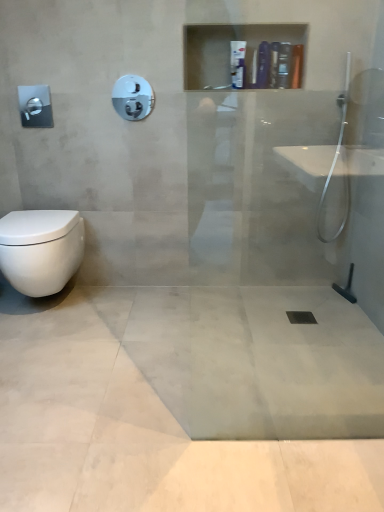
Question: Is point click(x=173, y=422) positioned closer to the camera than point click(x=281, y=49)?

Choices:
 (A) closer
 (B) farther

Answer: (A)

Question: Considering their positions, is light gray concrete at center located in front of or behind matte black soap dispenser at upper center, which ranks as the second toiletry in right-to-left order?

Choices:
 (A) behind
 (B) front

Answer: (B)

Question: Which object is the farthest from the white glossy towel bar at upper center, positioned as the first towel bar in top-to-bottom order?

Choices:
 (A) matte black soap dispenser at upper center, which ranks as the second toiletry in right-to-left order
 (B) silver metallic towel bar at upper left, the 1th towel bar when ordered from left to right
 (C) white glossy bottle at upper center, the 4th toiletry in the right-to-left sequence
 (D) white glossy bottle at upper center, which appears as the 1th toiletry when viewed from the left
 (E) matte plastic bottle at upper center, the third toiletry when ordered from left to right

Answer: (B)

Question: Considering the real-world distances, which object is closest to the white glossy toilet at lower left?

Choices:
 (A) matte black soap dispenser at upper center, which ranks as the second toiletry in right-to-left order
 (B) black rubber drain at center
 (C) silver metallic towel bar at upper left, the 1th towel bar when ordered from left to right
 (D) light gray concrete at center
 (E) white glossy bottle at upper center, the 4th toiletry in the right-to-left sequence

Answer: (D)